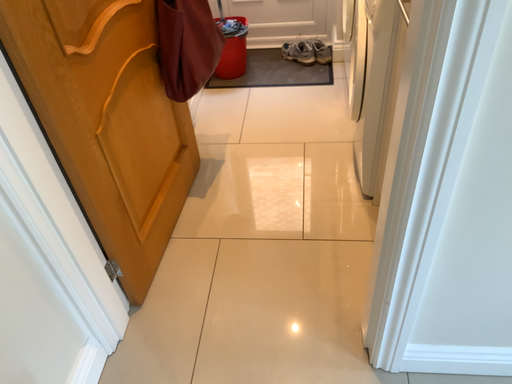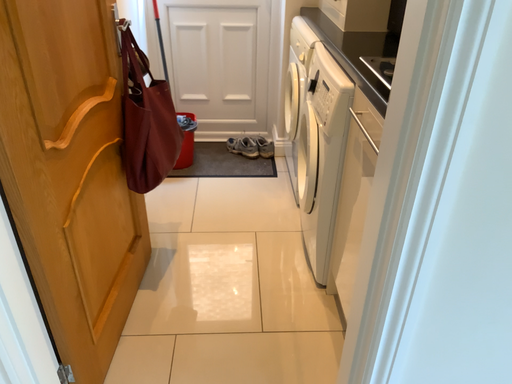
Question: How did the camera likely rotate when shooting the video?

Choices:
 (A) rotated right
 (B) rotated left

Answer: (A)